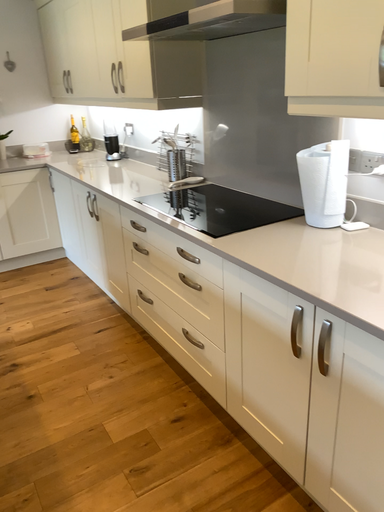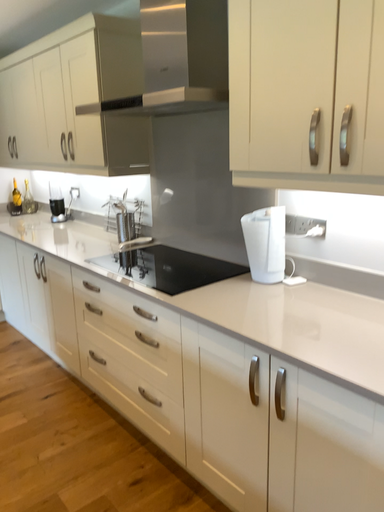
Question: How did the camera likely rotate when shooting the video?

Choices:
 (A) rotated downward
 (B) rotated upward

Answer: (B)